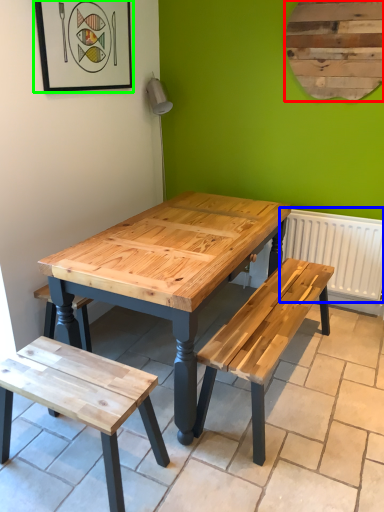
Question: Considering the real-world distances, which object is farthest from bulletin board (highlighted by a red box)? radiator (highlighted by a blue box) or picture frame (highlighted by a green box)?

Choices:
 (A) radiator
 (B) picture frame

Answer: (B)